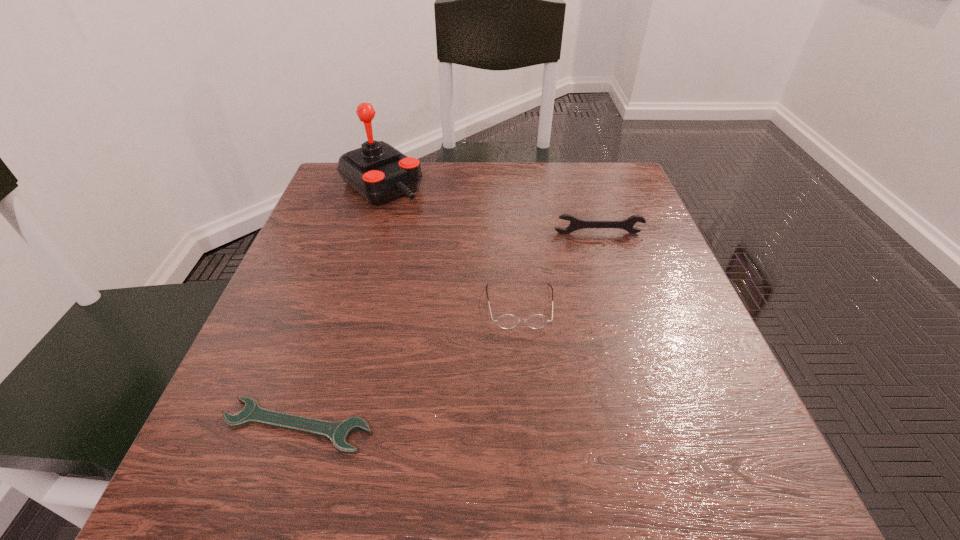
Identify the location of free region at the left edge of the desktop. (275, 298).

Where is `vacant area at the right edge of the desktop`? vacant area at the right edge of the desktop is located at coordinates (609, 237).

I want to click on free space at the far left corner, so click(x=329, y=200).

Locate an element on the screen. The image size is (960, 540). blank space at the far right corner of the desktop is located at coordinates (595, 175).

The image size is (960, 540). What are the coordinates of `free spot at the near right corner of the desktop` in the screenshot? It's located at pos(673,462).

The height and width of the screenshot is (540, 960). What are the coordinates of `free point between the shorter wrench and the farthest object` in the screenshot? It's located at (339, 306).

Locate an element on the screen. The image size is (960, 540). unoccupied area between the spectacles and the farthest object is located at coordinates (450, 246).

At what (x,y) coordinates should I click in order to perform the action: click on empty space between the shortest object and the tallest object. Please return your answer as a coordinate pair (x, y). Looking at the image, I should click on (339, 306).

At what (x,y) coordinates should I click in order to perform the action: click on free space between the spectacles and the shorter wrench. Please return your answer as a coordinate pair (x, y). Image resolution: width=960 pixels, height=540 pixels. Looking at the image, I should click on (408, 366).

Locate an element on the screen. The height and width of the screenshot is (540, 960). blank region between the third nearest object and the joystick is located at coordinates (490, 210).